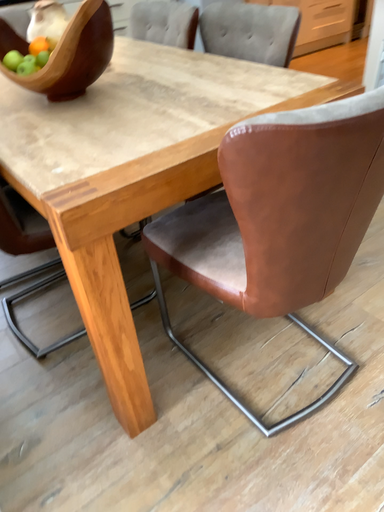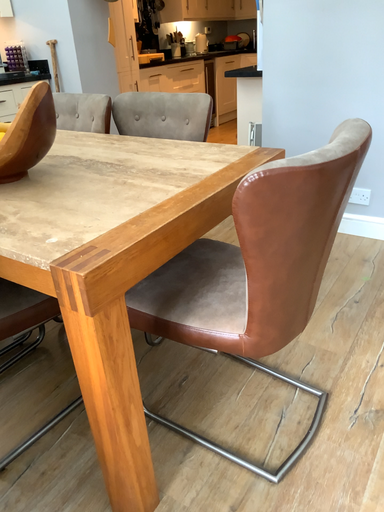
Question: How did the camera likely rotate when shooting the video?

Choices:
 (A) rotated right
 (B) rotated left

Answer: (A)